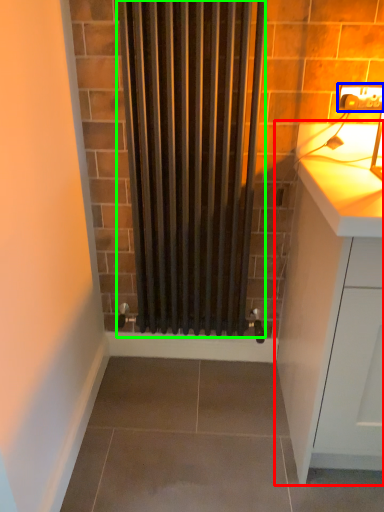
Question: Which object is the farthest from cabinetry (highlighted by a red box)? Choose among these: electric outlet (highlighted by a blue box) or shower curtain (highlighted by a green box).

Choices:
 (A) electric outlet
 (B) shower curtain

Answer: (A)